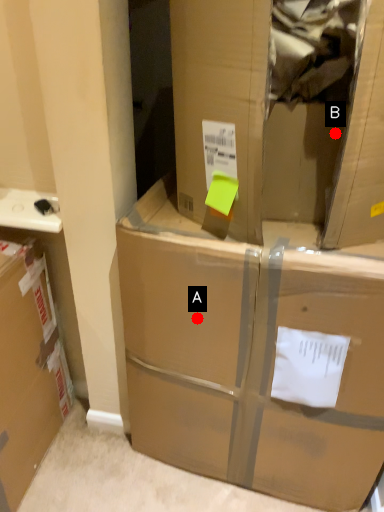
Question: Two points are circled on the image, labeled by A and B beside each circle. Which point appears closest to the camera in this image?

Choices:
 (A) A is closer
 (B) B is closer

Answer: (B)